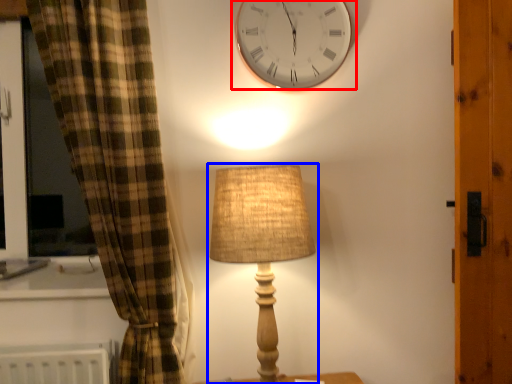
Question: Among these objects, which one is nearest to the camera, wall clock (highlighted by a red box) or lamp (highlighted by a blue box)?

Choices:
 (A) wall clock
 (B) lamp

Answer: (B)